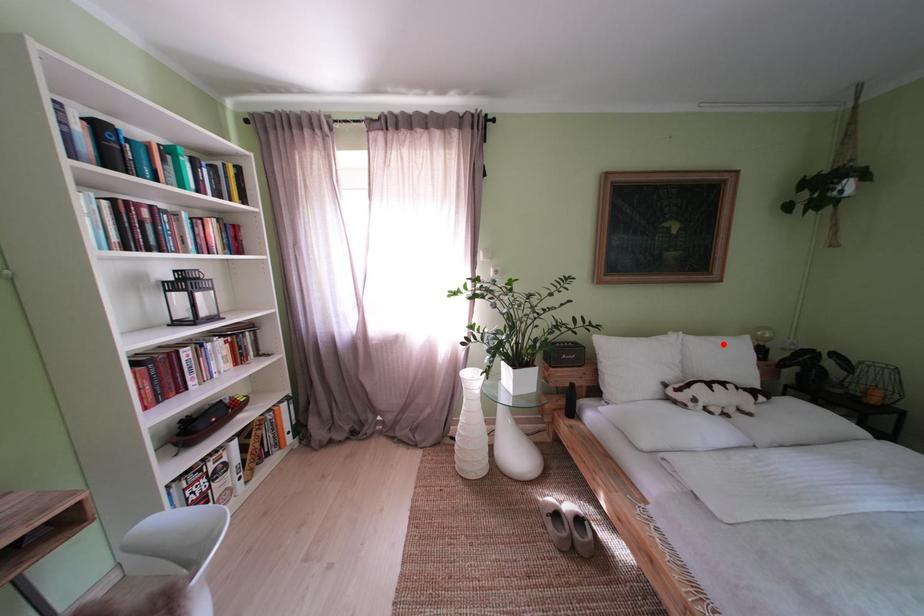
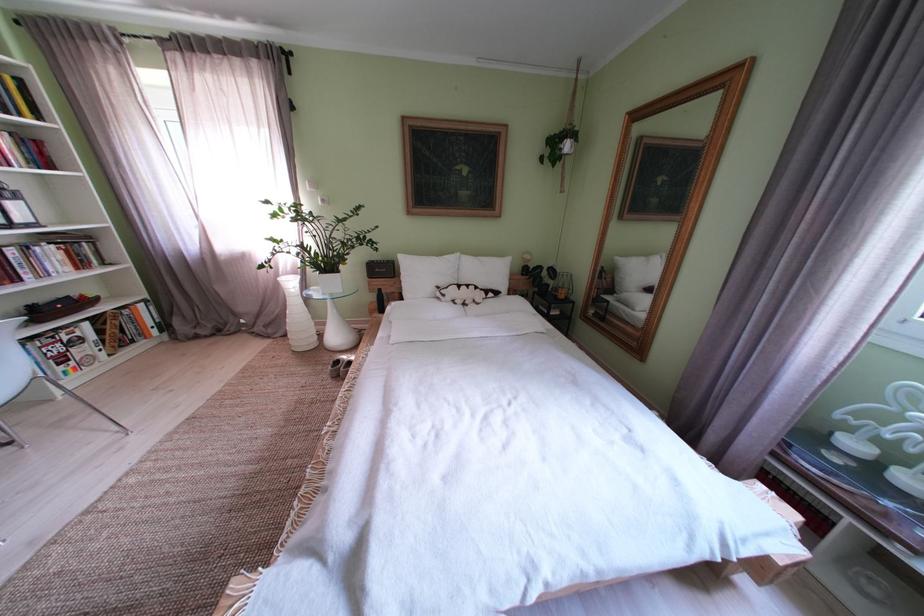
Where in the second image is the point corresponding to the highlighted location from the first image?

(492, 264)